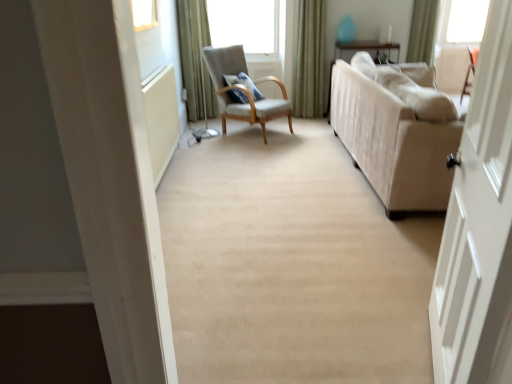
Question: Considering the relative positions of green velvet curtain at upper right, which is the second curtain from left to right, and beige fabric couch at right in the image provided, is green velvet curtain at upper right, which is the second curtain from left to right, to the left or to the right of beige fabric couch at right?

Choices:
 (A) right
 (B) left

Answer: (B)

Question: Is point (300, 74) closer or farther from the camera than point (333, 109)?

Choices:
 (A) closer
 (B) farther

Answer: (B)

Question: Estimate the real-world distances between objects in this image. Which object is farther from the light gray fabric chair at center?

Choices:
 (A) green velvet curtain at upper right, which is the second curtain from left to right
 (B) green fabric curtain at upper right, which is the first curtain in right-to-left order
 (C) blue textured pillow at center
 (D) green fabric curtain at upper left, arranged as the third curtain when viewed from the right
 (E) white wooden door at right

Answer: (E)

Question: Which object is positioned closest to the white wooden door at right?

Choices:
 (A) blue textured pillow at center
 (B) green velvet curtain at upper right, which is the second curtain from left to right
 (C) beige fabric couch at right
 (D) green fabric curtain at upper right, the third curtain when ordered from left to right
 (E) light gray fabric chair at center

Answer: (C)